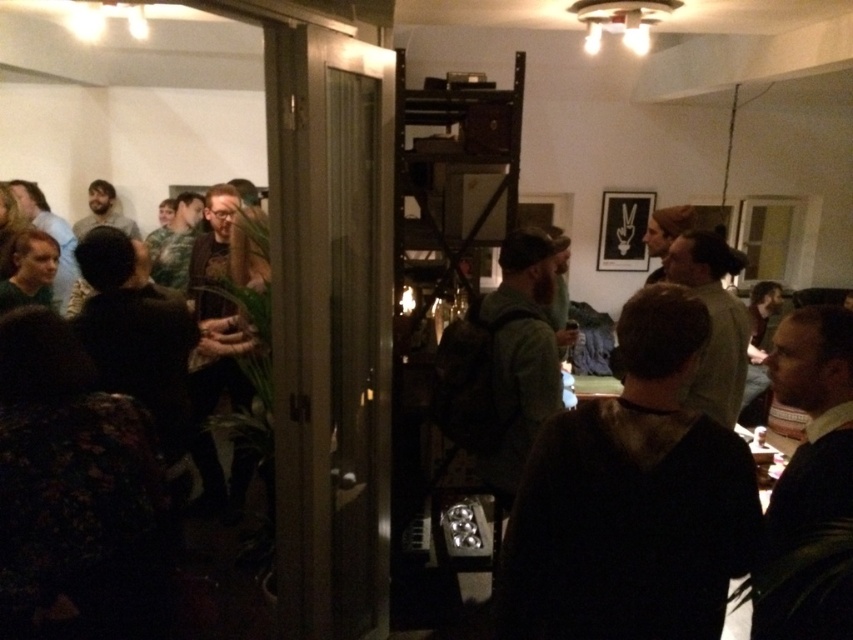
Question: Is dark brown hoodie at center to the right of dark brown leather jacket at left from the viewer's perspective?

Choices:
 (A) yes
 (B) no

Answer: (A)

Question: Can you confirm if dark brown hoodie at center is wider than dark brown leather jacket at left?

Choices:
 (A) yes
 (B) no

Answer: (A)

Question: Does dark brown hoodie at center have a lesser width compared to dark brown leather jacket at left?

Choices:
 (A) no
 (B) yes

Answer: (A)